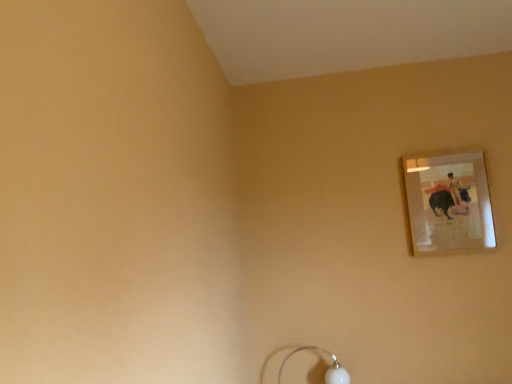
Question: From a real-world perspective, does matte glass picture frame at upper right sit lower than white glossy lamp at lower center?

Choices:
 (A) no
 (B) yes

Answer: (A)

Question: Considering the relative positions of matte glass picture frame at upper right and white glossy lamp at lower center in the image provided, is matte glass picture frame at upper right in front of white glossy lamp at lower center?

Choices:
 (A) yes
 (B) no

Answer: (B)

Question: Is matte glass picture frame at upper right next to white glossy lamp at lower center and touching it?

Choices:
 (A) yes
 (B) no

Answer: (B)

Question: Is there a large distance between matte glass picture frame at upper right and white glossy lamp at lower center?

Choices:
 (A) yes
 (B) no

Answer: (B)

Question: Is matte glass picture frame at upper right at the right side of white glossy lamp at lower center?

Choices:
 (A) yes
 (B) no

Answer: (A)

Question: From the image's perspective, is matte glass picture frame at upper right under white glossy lamp at lower center?

Choices:
 (A) no
 (B) yes

Answer: (A)

Question: Is white glossy lamp at lower center oriented towards matte glass picture frame at upper right?

Choices:
 (A) yes
 (B) no

Answer: (B)

Question: Is the position of white glossy lamp at lower center less distant than that of matte glass picture frame at upper right?

Choices:
 (A) no
 (B) yes

Answer: (B)

Question: From the image's perspective, is white glossy lamp at lower center on top of matte glass picture frame at upper right?

Choices:
 (A) no
 (B) yes

Answer: (A)

Question: Is matte glass picture frame at upper right at the back of white glossy lamp at lower center?

Choices:
 (A) yes
 (B) no

Answer: (B)

Question: Is there a large distance between white glossy lamp at lower center and matte glass picture frame at upper right?

Choices:
 (A) no
 (B) yes

Answer: (A)

Question: From the image's perspective, would you say white glossy lamp at lower center is shown under matte glass picture frame at upper right?

Choices:
 (A) no
 (B) yes

Answer: (B)

Question: From their relative heights in the image, would you say matte glass picture frame at upper right is taller or shorter than white glossy lamp at lower center?

Choices:
 (A) tall
 (B) short

Answer: (A)